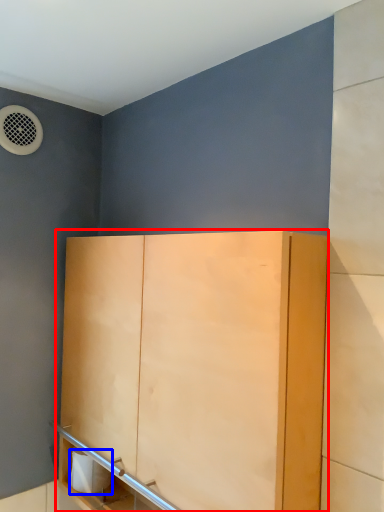
Question: Which object is closer to the camera taking this photo, cupboard (highlighted by a red box) or toilet paper (highlighted by a blue box)?

Choices:
 (A) cupboard
 (B) toilet paper

Answer: (A)